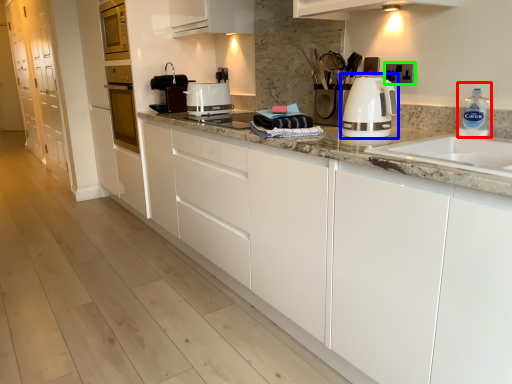
Question: Based on their relative distances, which object is farther from cleaning product (highlighted by a red box)? Choose from home appliance (highlighted by a blue box) and electric outlet (highlighted by a green box).

Choices:
 (A) home appliance
 (B) electric outlet

Answer: (A)